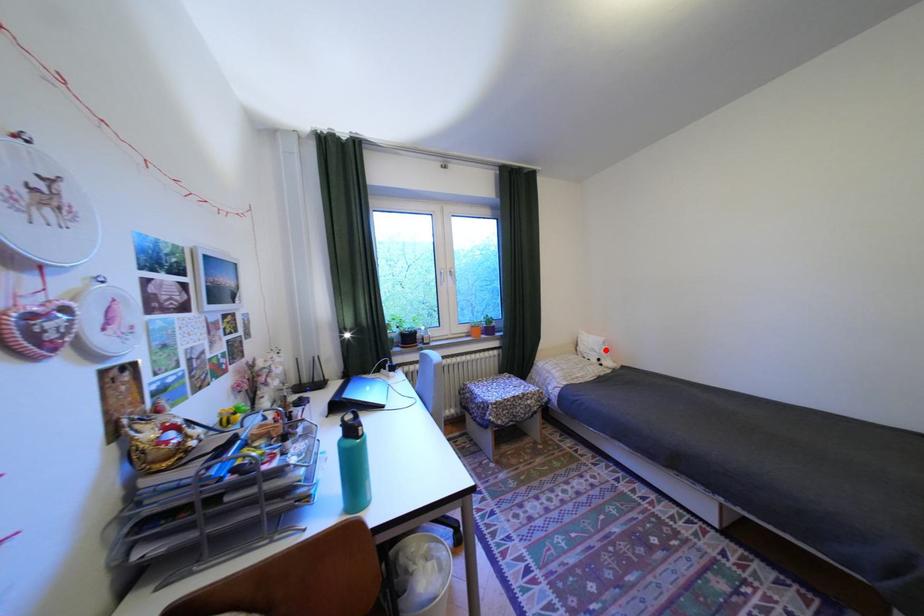
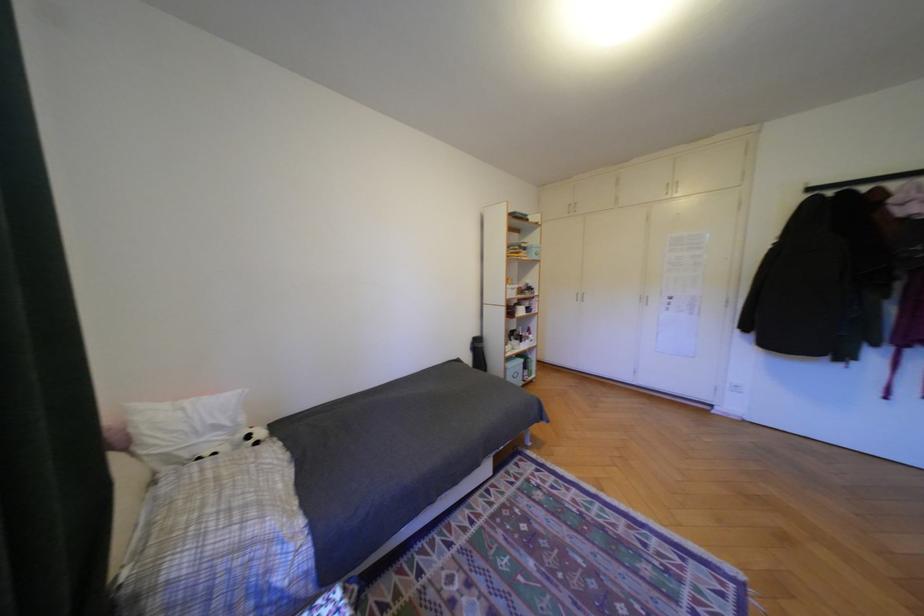
Question: A red point is marked in image1. In image2, is the corresponding 3D point closer to the camera or farther? Reply with the corresponding letter.

Choices:
 (A) The corresponding 3D point is closer.
 (B) The corresponding 3D point is farther.

Answer: (A)